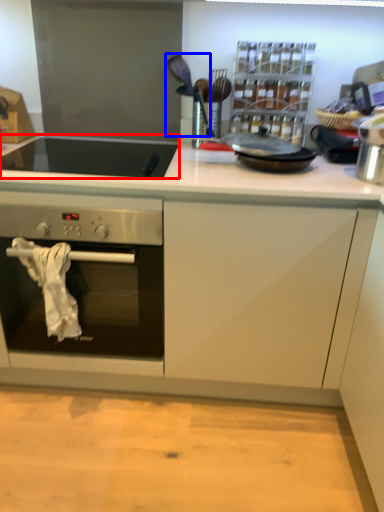
Question: Among these objects, which one is nearest to the camera, gas stove (highlighted by a red box) or appliance (highlighted by a blue box)?

Choices:
 (A) gas stove
 (B) appliance

Answer: (A)